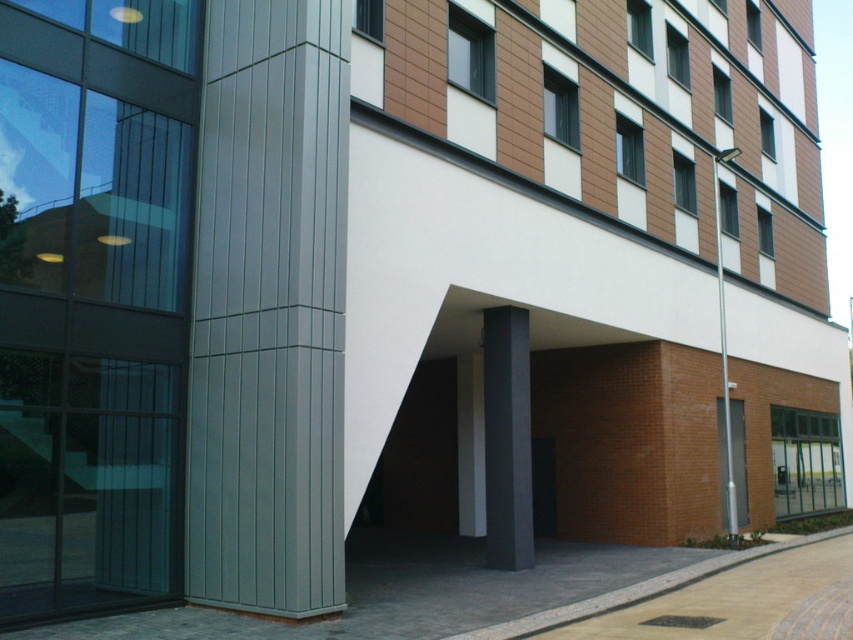
Which is more to the left, silver metallic pole at right or black glass door at center?

From the viewer's perspective, black glass door at center appears more on the left side.

Is silver metallic pole at right in front of black glass door at center?

No, silver metallic pole at right is further to the viewer.

Is point (741, 481) positioned after point (552, 470)?

That is True.

At what (x,y) coordinates should I click in order to perform the action: click on silver metallic pole at right. Please return your answer as a coordinate pair (x, y). Looking at the image, I should click on (738, 460).